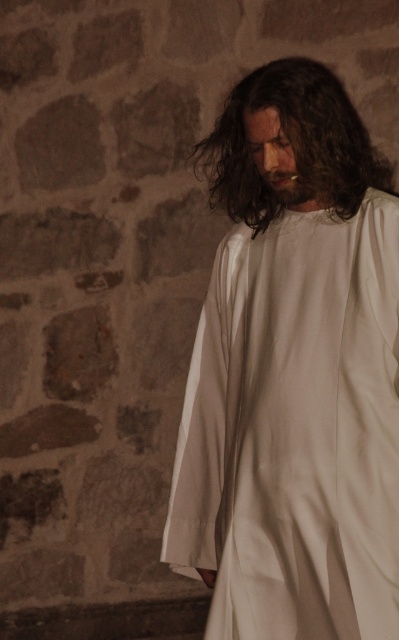
Question: From the image, what is the correct spatial relationship of white cloth at center in relation to dark brown silky hair at center?

Choices:
 (A) right
 (B) left

Answer: (A)

Question: Among these objects, which one is farthest from the camera?

Choices:
 (A) white cloth at center
 (B) dark brown silky hair at center

Answer: (B)

Question: Is white cloth at center in front of dark brown silky hair at center?

Choices:
 (A) yes
 (B) no

Answer: (A)

Question: Which point is closer to the camera taking this photo?

Choices:
 (A) 365,586
 (B) 389,184

Answer: (A)

Question: Does white cloth at center appear on the left side of dark brown silky hair at center?

Choices:
 (A) no
 (B) yes

Answer: (A)